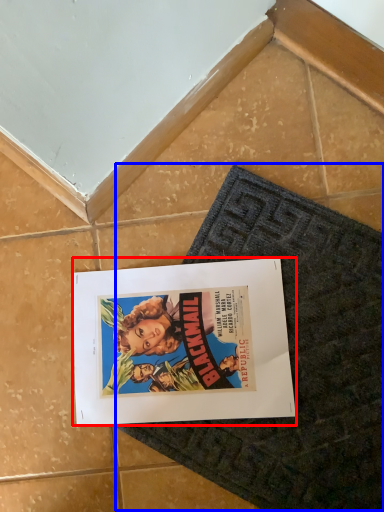
Question: Which point is closer to the camera, poster (highlighted by a red box) or bath mat (highlighted by a blue box)?

Choices:
 (A) poster
 (B) bath mat

Answer: (B)